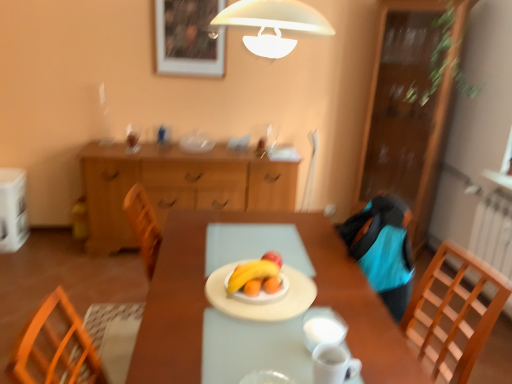
Question: From the image's perspective, is white fabric armchair at upper center below shiny red apple at center?

Choices:
 (A) yes
 (B) no

Answer: (B)

Question: Considering the relative positions of white fabric armchair at upper center and shiny red apple at center in the image provided, is white fabric armchair at upper center to the right of shiny red apple at center from the viewer's perspective?

Choices:
 (A) no
 (B) yes

Answer: (B)

Question: Is white fabric armchair at upper center closer to camera compared to shiny red apple at center?

Choices:
 (A) no
 (B) yes

Answer: (A)

Question: Is white fabric armchair at upper center bigger than shiny red apple at center?

Choices:
 (A) yes
 (B) no

Answer: (A)

Question: From the image's perspective, would you say white fabric armchair at upper center is positioned over shiny red apple at center?

Choices:
 (A) yes
 (B) no

Answer: (A)

Question: Does white fabric armchair at upper center have a greater height compared to shiny red apple at center?

Choices:
 (A) no
 (B) yes

Answer: (B)

Question: Can white glossy mug at lower center, which is the 2th tableware from front to back, be found inside white matte plate at center, positioned as the 1th tableware in back-to-front order?

Choices:
 (A) yes
 (B) no

Answer: (B)

Question: Can you see white matte plate at center, positioned as the 1th tableware in back-to-front order, touching white glossy mug at lower center, which is the 2th tableware from front to back?

Choices:
 (A) yes
 (B) no

Answer: (B)

Question: From a real-world perspective, is white matte plate at center, which is the fourth tableware in front-to-back order, positioned over white glossy mug at lower center, which is the 2th tableware from front to back, based on gravity?

Choices:
 (A) yes
 (B) no

Answer: (B)

Question: Does white matte plate at center, positioned as the 1th tableware in back-to-front order, have a smaller size compared to white glossy mug at lower center, the 3th tableware viewed from the back?

Choices:
 (A) no
 (B) yes

Answer: (A)

Question: Considering the relative positions of white matte plate at center, which is the fourth tableware in front-to-back order, and white glossy mug at lower center, the 3th tableware viewed from the back, in the image provided, is white matte plate at center, which is the fourth tableware in front-to-back order, to the left of white glossy mug at lower center, the 3th tableware viewed from the back, from the viewer's perspective?

Choices:
 (A) yes
 (B) no

Answer: (A)

Question: From a real-world perspective, is white matte plate at center, positioned as the 1th tableware in back-to-front order, under white glossy mug at lower center, the 3th tableware viewed from the back?

Choices:
 (A) no
 (B) yes

Answer: (B)

Question: Are yellow matte banana at center and white fabric armchair at upper center beside each other?

Choices:
 (A) no
 (B) yes

Answer: (A)